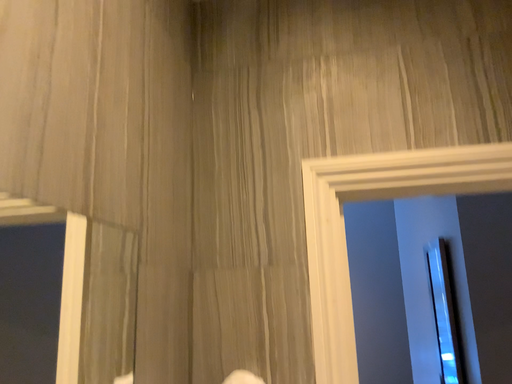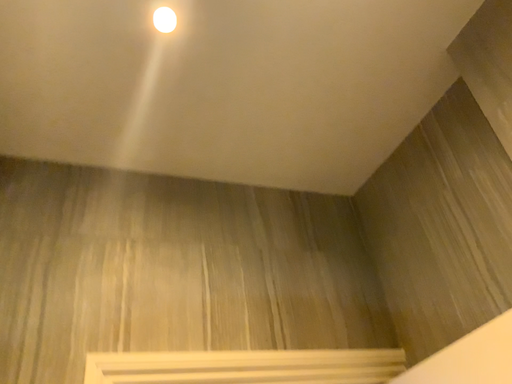
Question: Which way did the camera rotate in the video?

Choices:
 (A) rotated left
 (B) rotated right

Answer: (B)